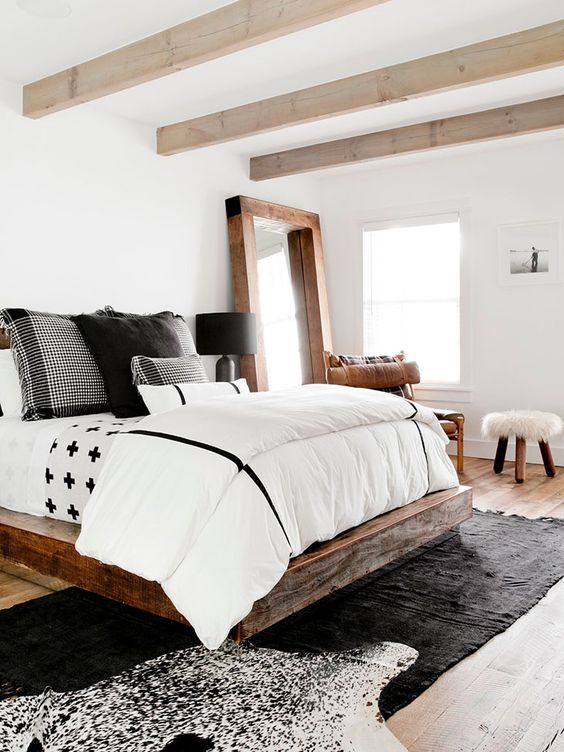
Identify the location of wood trim. The width and height of the screenshot is (564, 752). pos(237,237).